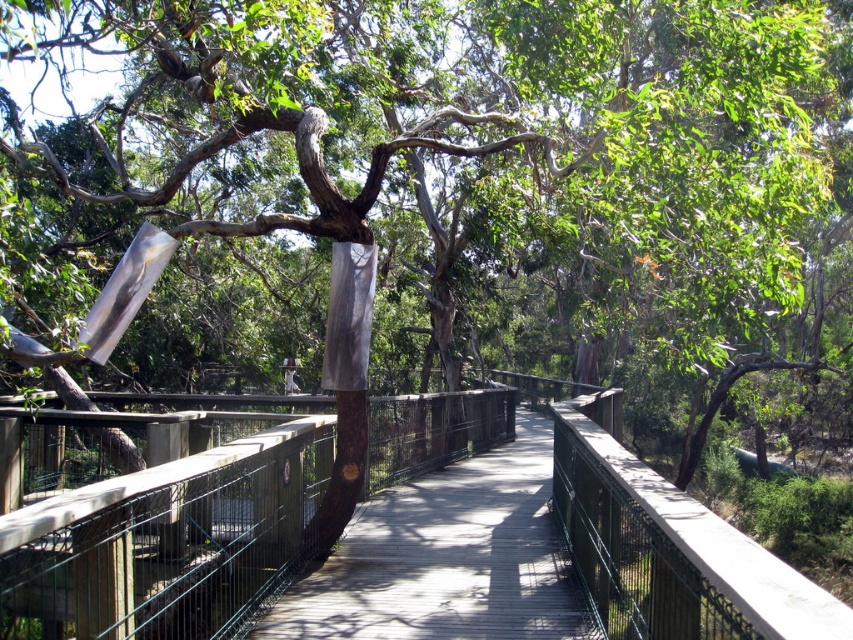
Question: Which of the following is the farthest from the observer?

Choices:
 (A) wooden bridge at center
 (B) wooden walkway at center

Answer: (B)

Question: Is the position of wooden bridge at center less distant than that of wooden walkway at center?

Choices:
 (A) yes
 (B) no

Answer: (A)

Question: Does wooden bridge at center appear on the left side of wooden walkway at center?

Choices:
 (A) yes
 (B) no

Answer: (B)

Question: Among these objects, which one is farthest from the camera?

Choices:
 (A) wooden walkway at center
 (B) wooden bridge at center

Answer: (A)

Question: Does wooden bridge at center have a larger size compared to wooden walkway at center?

Choices:
 (A) yes
 (B) no

Answer: (A)